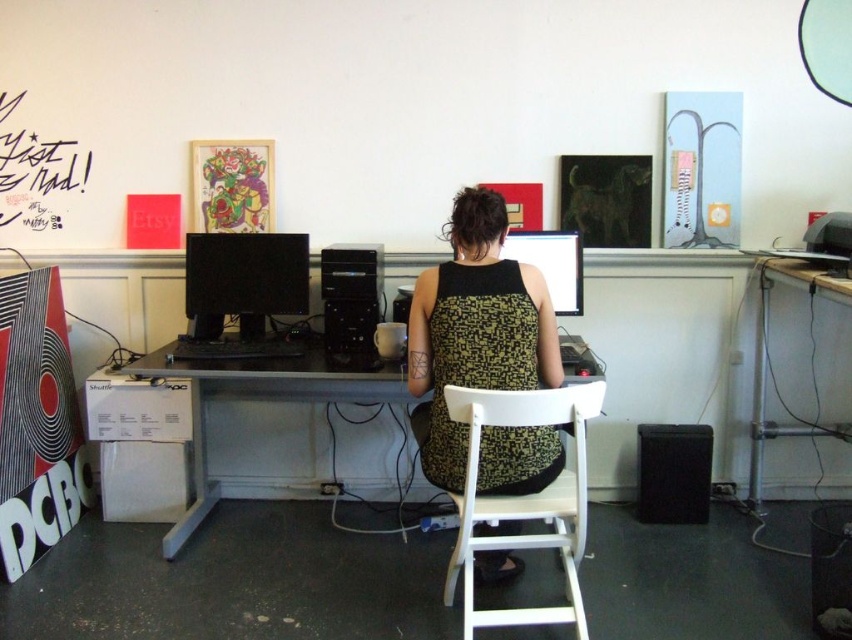
Question: Is white plastic computer desk at center positioned in front of black matte speaker at lower right?

Choices:
 (A) no
 (B) yes

Answer: (B)

Question: Which object is the closest to the black matte speaker at lower right?

Choices:
 (A) matte black monitor at center
 (B) white plastic chair at center

Answer: (A)

Question: Does white plastic computer desk at center lie in front of black plastic monitor at center?

Choices:
 (A) yes
 (B) no

Answer: (A)

Question: Estimate the real-world distances between objects in this image. Which object is closer to the black plastic monitor at center?

Choices:
 (A) green textured dress at center
 (B) black matte speaker at lower right
 (C) metallic silver table at right

Answer: (A)

Question: Which object appears farthest from the camera in this image?

Choices:
 (A) matte black monitor at center
 (B) black matte speaker at lower right
 (C) black plastic monitor at center

Answer: (B)

Question: Is green textured dress at center closer to the viewer compared to black plastic monitor at center?

Choices:
 (A) yes
 (B) no

Answer: (A)